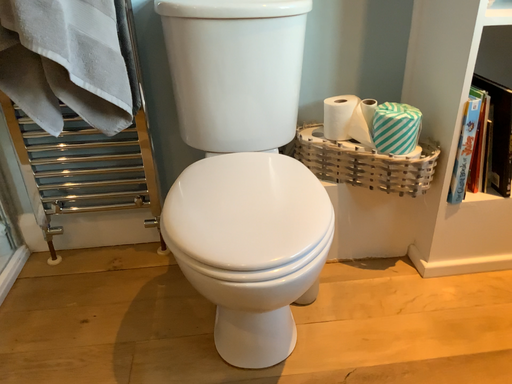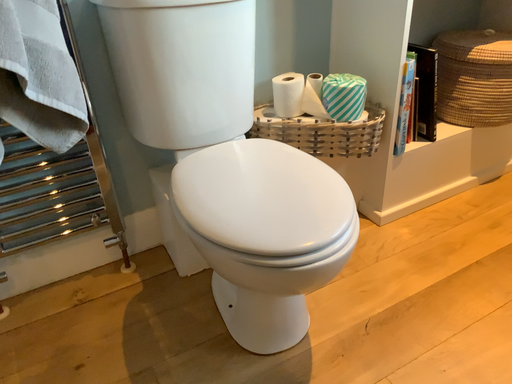
Question: Which way did the camera rotate in the video?

Choices:
 (A) rotated left
 (B) rotated right

Answer: (B)